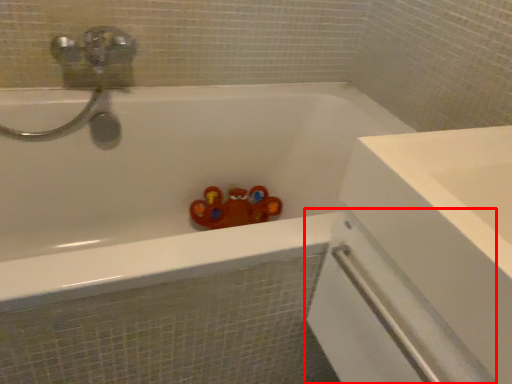
Question: From the image's perspective, where is screen door (annotated by the red box) located relative to bathtub?

Choices:
 (A) above
 (B) below

Answer: (B)